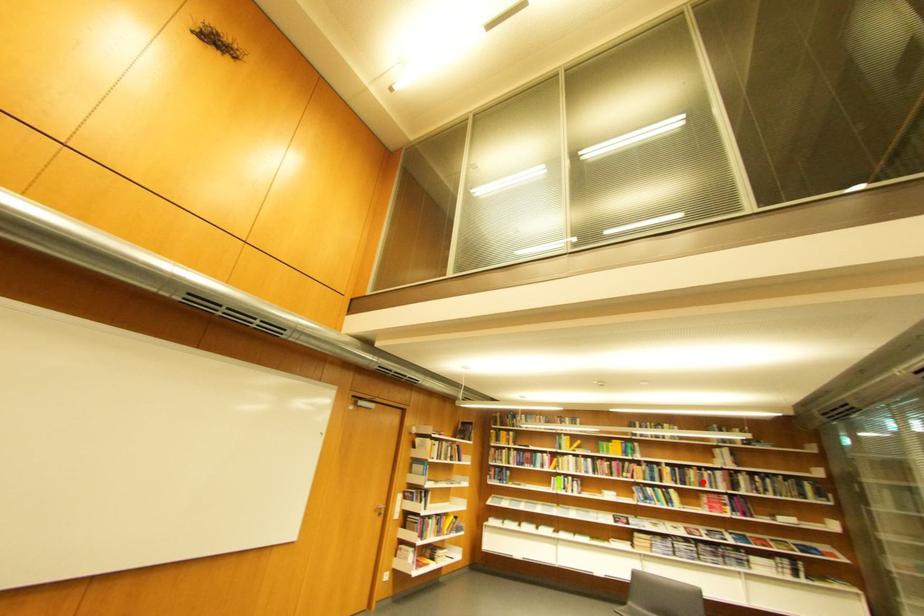
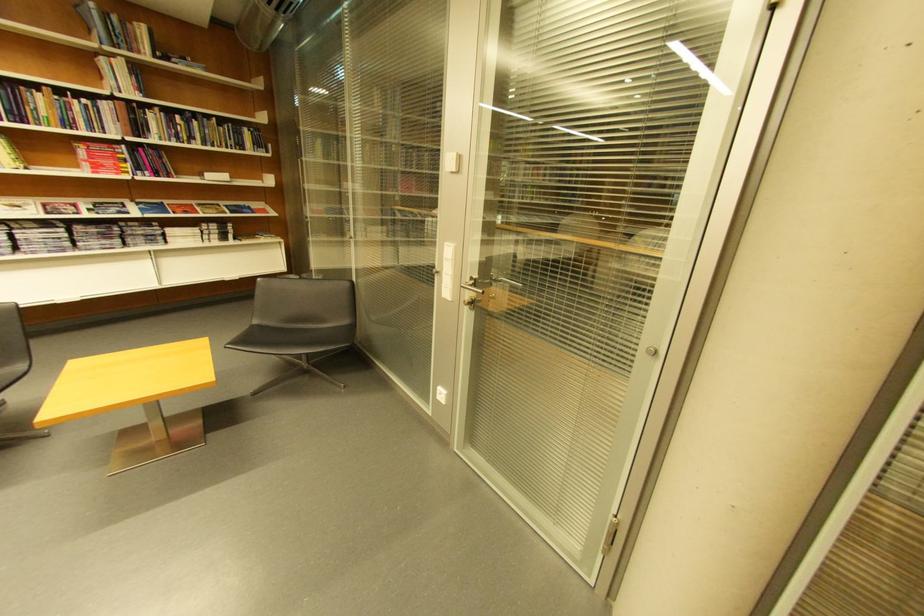
Question: A red point is marked in image1. In image2, is the corresponding 3D point closer to the camera or farther? Reply with the corresponding letter.

Choices:
 (A) The corresponding 3D point is closer.
 (B) The corresponding 3D point is farther.

Answer: (B)